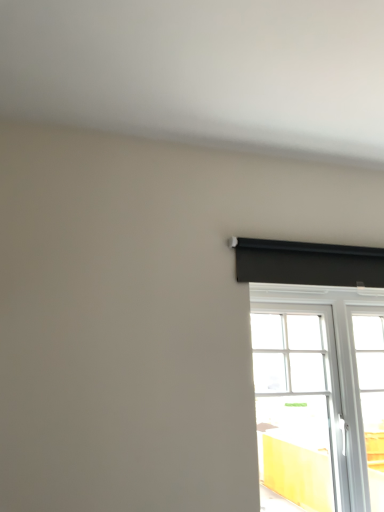
Question: Is white glass window at right closer to camera compared to black matte curtain at upper right?

Choices:
 (A) yes
 (B) no

Answer: (A)

Question: Does white glass window at right have a lesser height compared to black matte curtain at upper right?

Choices:
 (A) yes
 (B) no

Answer: (B)

Question: Is white glass window at right positioned far away from black matte curtain at upper right?

Choices:
 (A) no
 (B) yes

Answer: (A)

Question: Does white glass window at right have a lesser width compared to black matte curtain at upper right?

Choices:
 (A) no
 (B) yes

Answer: (A)

Question: Is white glass window at right surrounding black matte curtain at upper right?

Choices:
 (A) yes
 (B) no

Answer: (B)

Question: Considering the relative positions of white glass window at right and black matte curtain at upper right in the image provided, is white glass window at right to the left of black matte curtain at upper right from the viewer's perspective?

Choices:
 (A) yes
 (B) no

Answer: (B)

Question: Is black matte curtain at upper right further to the viewer compared to white glass window at right?

Choices:
 (A) no
 (B) yes

Answer: (B)

Question: Would you say black matte curtain at upper right contains white glass window at right?

Choices:
 (A) yes
 (B) no

Answer: (B)

Question: Does black matte curtain at upper right have a lesser width compared to white glass window at right?

Choices:
 (A) no
 (B) yes

Answer: (B)

Question: Considering the relative sizes of black matte curtain at upper right and white glass window at right in the image provided, is black matte curtain at upper right bigger than white glass window at right?

Choices:
 (A) yes
 (B) no

Answer: (B)

Question: Is black matte curtain at upper right far from white glass window at right?

Choices:
 (A) yes
 (B) no

Answer: (B)

Question: From the image's perspective, is black matte curtain at upper right beneath white glass window at right?

Choices:
 (A) no
 (B) yes

Answer: (A)

Question: Is black matte curtain at upper right bigger or smaller than white glass window at right?

Choices:
 (A) big
 (B) small

Answer: (B)